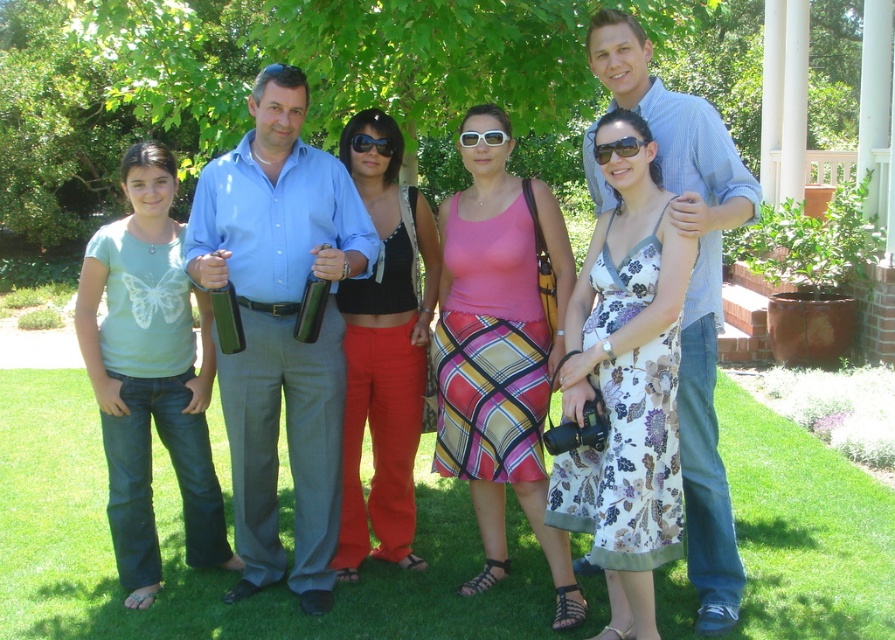
Is light blue t-shirt at left closer to the viewer compared to black satin tank top at center?

Yes, it is.

Is light blue t-shirt at left taller than black satin tank top at center?

No, light blue t-shirt at left is not taller than black satin tank top at center.

Which is in front, point (193, 403) or point (416, 227)?

Point (193, 403) is more forward.

The image size is (895, 640). Find the location of `light blue t-shirt at left`. light blue t-shirt at left is located at coordinates [149, 376].

Does blue cotton shirt at center have a smaller size compared to matte black sunglasses at center?

Incorrect, blue cotton shirt at center is not smaller in size than matte black sunglasses at center.

Is blue cotton shirt at center thinner than matte black sunglasses at center?

Incorrect, blue cotton shirt at center's width is not less than matte black sunglasses at center's.

Between point (256, 452) and point (603, 148), which one is positioned in front?

Positioned in front is point (603, 148).

At what (x,y) coordinates should I click in order to perform the action: click on blue cotton shirt at center. Please return your answer as a coordinate pair (x, y). This screenshot has height=640, width=895. Looking at the image, I should click on (280, 328).

Who is taller, floral dress at center or black satin tank top at center?

black satin tank top at center

Is floral dress at center to the right of black satin tank top at center from the viewer's perspective?

Correct, you'll find floral dress at center to the right of black satin tank top at center.

What do you see at coordinates (626, 385) in the screenshot? I see `floral dress at center` at bounding box center [626, 385].

The image size is (895, 640). Identify the location of floral dress at center. (626, 385).